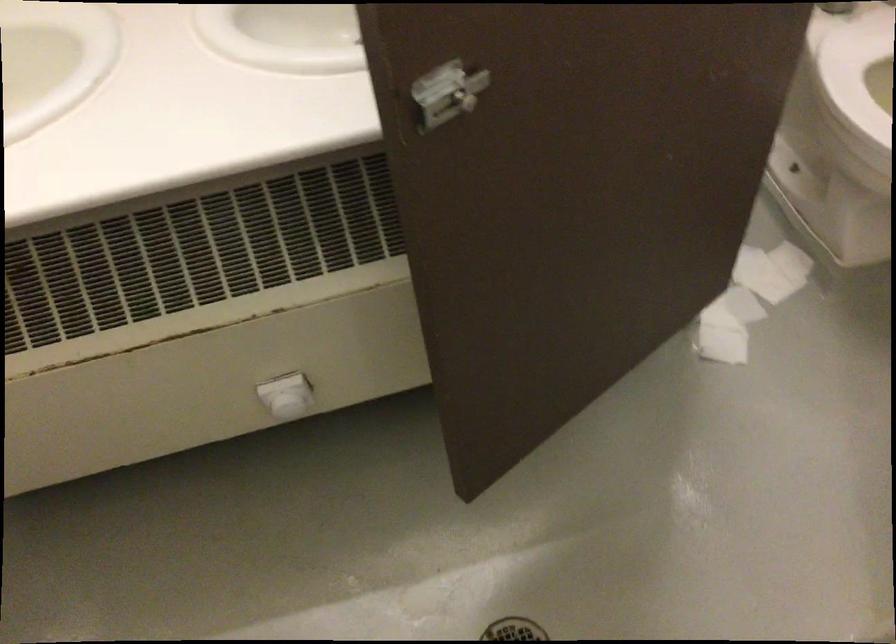
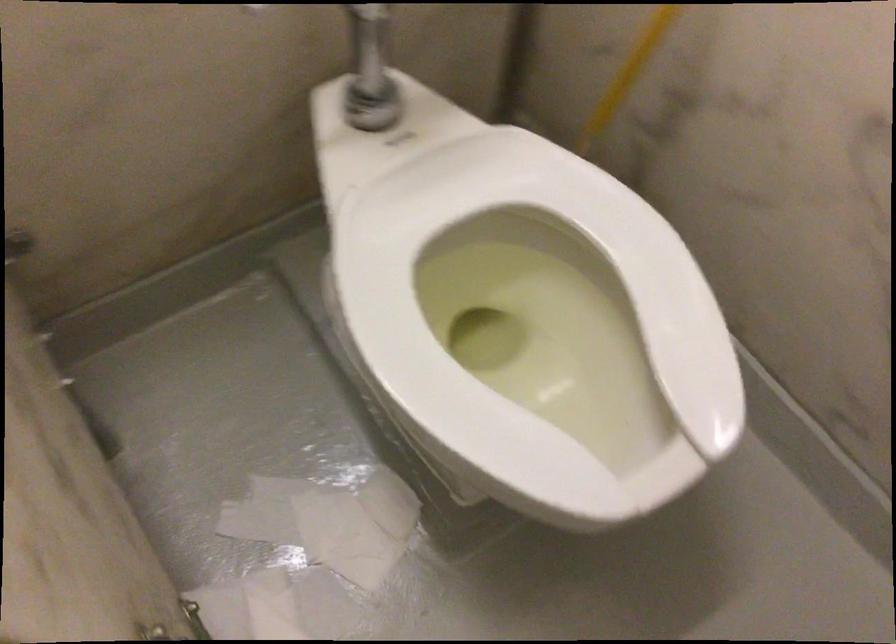
Find the pixel in the second image that matches point 739,252 in the first image.

(320, 529)